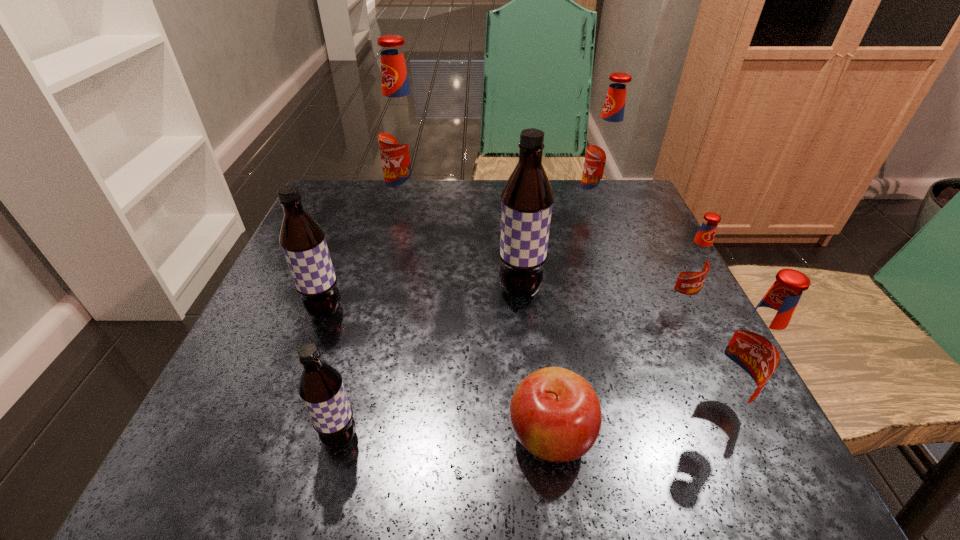
Choose which object is the fifth nearest neighbor to the leftmost object. Please provide its 2D coordinates. Your answer should be formatted as a tuple, i.e. [(x, y)], where the tuple contains the x and y coordinates of a point satisfying the conditions above.

[(606, 151)]

Find the location of `object that is the closest to the leftmost root beer`. object that is the closest to the leftmost root beer is located at coordinates (321, 388).

The height and width of the screenshot is (540, 960). Identify the location of root beer that is the sixth closest to the second nearest red root beer. (302, 239).

Identify the location of the second closest root beer to the nearest brown root beer. (527, 199).

Identify which red root beer is located as the second nearest to the nearest red root beer. Please provide its 2D coordinates. Your answer should be formatted as a tuple, i.e. [(x, y)], where the tuple contains the x and y coordinates of a point satisfying the conditions above.

[(606, 151)]

Identify which red root beer is the third closest to the biggest brown root beer. Please provide its 2D coordinates. Your answer should be formatted as a tuple, i.e. [(x, y)], where the tuple contains the x and y coordinates of a point satisfying the conditions above.

[(401, 134)]

Identify which brown root beer is located as the nearest to the second brown root beer from right to left. Please provide its 2D coordinates. Your answer should be formatted as a tuple, i.e. [(x, y)], where the tuple contains the x and y coordinates of a point satisfying the conditions above.

[(302, 239)]

Locate an element on the screen. The width and height of the screenshot is (960, 540). brown root beer that is the nearest to the tallest object is located at coordinates (527, 199).

The height and width of the screenshot is (540, 960). In order to click on vacant region that satisfies the following two spatial constraints: 1. on the front side of the second smallest brown root beer; 2. on the left side of the shortest object in this screenshot , I will do `click(278, 436)`.

Locate an element on the screen. This screenshot has height=540, width=960. vacant space that satisfies the following two spatial constraints: 1. on the back side of the leftmost brown root beer; 2. on the right side of the biggest red root beer is located at coordinates (364, 207).